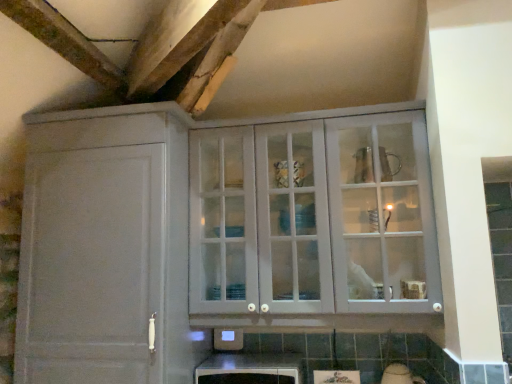
Question: From the image's perspective, is matte gray cabinet at upper center, which appears as the second cabinetry when viewed from the right, on white glossy microwave at lower center, arranged as the 2th cabinetry when viewed from the left?

Choices:
 (A) yes
 (B) no

Answer: (A)

Question: Can you confirm if matte gray cabinet at upper center, which appears as the second cabinetry when viewed from the right, is taller than white glossy microwave at lower center, marked as the first cabinetry in a right-to-left arrangement?

Choices:
 (A) yes
 (B) no

Answer: (A)

Question: Considering the relative sizes of matte gray cabinet at upper center, the first cabinetry viewed from the left, and white glossy microwave at lower center, marked as the first cabinetry in a right-to-left arrangement, in the image provided, is matte gray cabinet at upper center, the first cabinetry viewed from the left, bigger than white glossy microwave at lower center, marked as the first cabinetry in a right-to-left arrangement,?

Choices:
 (A) no
 (B) yes

Answer: (B)

Question: Is white glossy microwave at lower center, marked as the first cabinetry in a right-to-left arrangement, located within matte gray cabinet at upper center, the first cabinetry viewed from the left?

Choices:
 (A) no
 (B) yes

Answer: (A)

Question: Is matte gray cabinet at upper center, which appears as the second cabinetry when viewed from the right, facing away from white glossy microwave at lower center, arranged as the 2th cabinetry when viewed from the left?

Choices:
 (A) no
 (B) yes

Answer: (A)

Question: Is the depth of matte gray cabinet at upper center, which appears as the second cabinetry when viewed from the right, greater than that of white glossy microwave at lower center, marked as the first cabinetry in a right-to-left arrangement?

Choices:
 (A) yes
 (B) no

Answer: (B)

Question: Is white glossy microwave at lower center, arranged as the 2th cabinetry when viewed from the left, smaller than matte gray cabinet at upper center, which appears as the second cabinetry when viewed from the right?

Choices:
 (A) no
 (B) yes

Answer: (B)

Question: Is white glossy microwave at lower center, arranged as the 2th cabinetry when viewed from the left, positioned with its back to matte gray cabinet at upper center, the first cabinetry viewed from the left?

Choices:
 (A) yes
 (B) no

Answer: (B)

Question: From a real-world perspective, does white glossy microwave at lower center, arranged as the 2th cabinetry when viewed from the left, stand above matte gray cabinet at upper center, the first cabinetry viewed from the left?

Choices:
 (A) yes
 (B) no

Answer: (B)

Question: Is white glossy microwave at lower center, marked as the first cabinetry in a right-to-left arrangement, outside of matte gray cabinet at upper center, which appears as the second cabinetry when viewed from the right?

Choices:
 (A) yes
 (B) no

Answer: (A)

Question: Is white glossy microwave at lower center, marked as the first cabinetry in a right-to-left arrangement, positioned far away from matte gray cabinet at upper center, the first cabinetry viewed from the left?

Choices:
 (A) yes
 (B) no

Answer: (B)

Question: Is white glossy microwave at lower center, marked as the first cabinetry in a right-to-left arrangement, thinner than matte gray cabinet at upper center, the first cabinetry viewed from the left?

Choices:
 (A) no
 (B) yes

Answer: (B)

Question: Is white glass cabinet at upper center positioned with its back to matte gray cabinet at upper center, which appears as the second cabinetry when viewed from the right?

Choices:
 (A) yes
 (B) no

Answer: (B)